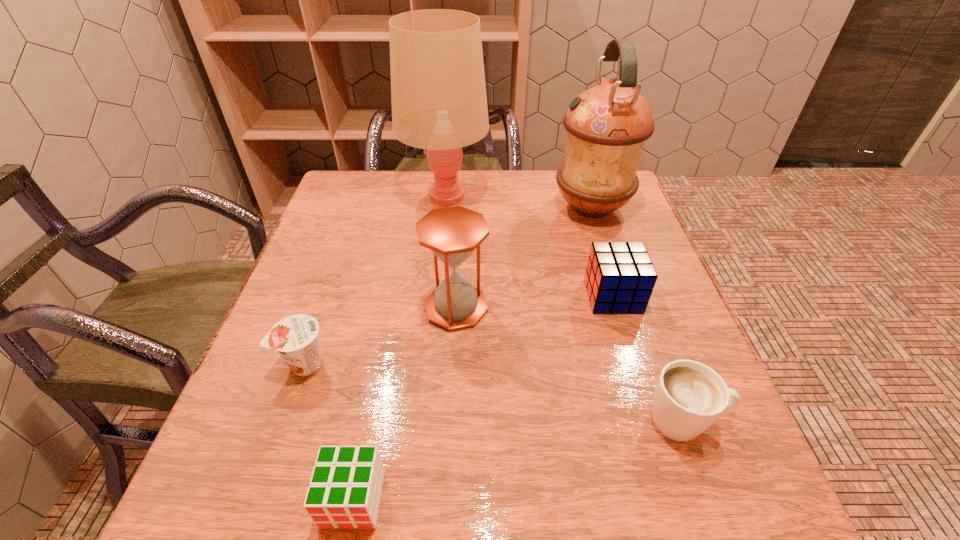
The image size is (960, 540). Identify the location of cube located in the right edge section of the desktop. (619, 278).

Where is `cappuccino situated at the right edge`? The width and height of the screenshot is (960, 540). cappuccino situated at the right edge is located at coordinates (689, 397).

The image size is (960, 540). In order to click on object positioned at the far right corner in this screenshot , I will do `click(607, 125)`.

In the image, there is a desktop. Where is `vacant space at the far edge`? Image resolution: width=960 pixels, height=540 pixels. vacant space at the far edge is located at coordinates (419, 173).

In the image, there is a desktop. Where is `vacant region at the near edge`? The image size is (960, 540). vacant region at the near edge is located at coordinates (438, 481).

At what (x,y) coordinates should I click in order to perform the action: click on free space at the left edge of the desktop. Please return your answer as a coordinate pair (x, y). Looking at the image, I should click on (329, 352).

The image size is (960, 540). I want to click on free region at the far left corner of the desktop, so click(x=387, y=179).

This screenshot has height=540, width=960. In the image, there is a desktop. In order to click on vacant space at the near left corner in this screenshot , I will do `click(237, 479)`.

At what (x,y) coordinates should I click in order to perform the action: click on vacant space at the near right corner. Please return your answer as a coordinate pair (x, y). This screenshot has width=960, height=540. Looking at the image, I should click on (681, 496).

Where is `free space between the shorter cube and the second nearest object`? The height and width of the screenshot is (540, 960). free space between the shorter cube and the second nearest object is located at coordinates (518, 460).